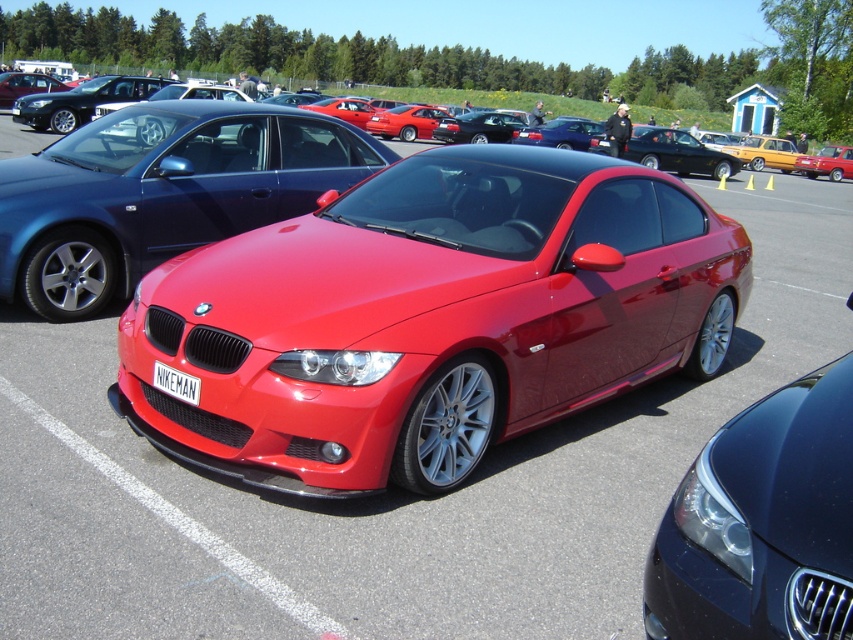
Who is shorter, shiny metallic car at center or white plastic license plate at center?

Standing shorter between the two is white plastic license plate at center.

Who is taller, shiny metallic car at center or white plastic license plate at center?

Standing taller between the two is shiny metallic car at center.

Describe the element at coordinates (430, 317) in the screenshot. I see `shiny metallic car at center` at that location.

Locate an element on the screen. The image size is (853, 640). shiny metallic car at center is located at coordinates (430, 317).

Between point (236, 168) and point (15, 99), which one is positioned in front?

Point (236, 168) is more forward.

Does glossy metallic sedan at center have a lesser width compared to matte black car at upper left?

Indeed, glossy metallic sedan at center has a lesser width compared to matte black car at upper left.

Find the location of a particular element. glossy metallic sedan at center is located at coordinates (161, 193).

Does glossy metallic sedan at center have a smaller size compared to white plastic license plate at center?

No, glossy metallic sedan at center is not smaller than white plastic license plate at center.

Is glossy metallic sedan at center shorter than white plastic license plate at center?

Incorrect, glossy metallic sedan at center's height does not fall short of white plastic license plate at center's.

Is point (0, 248) behind point (160, 364)?

That is True.

Where is `glossy metallic sedan at center`? This screenshot has width=853, height=640. glossy metallic sedan at center is located at coordinates (161, 193).